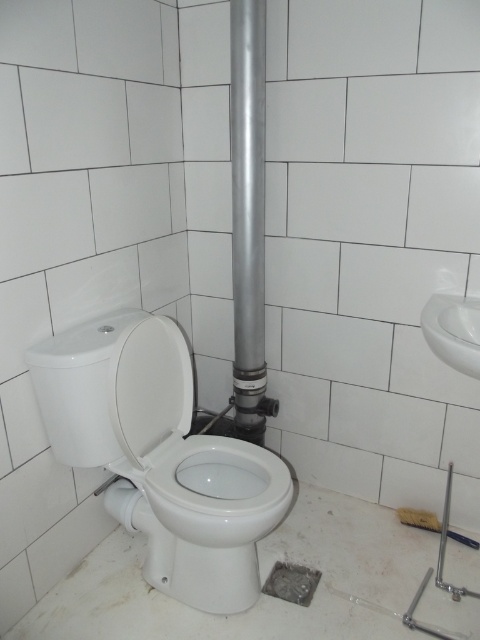
You are a bathroom cleaner and need to disinfect the white glossy toilet bowl at center and the white glossy toilet lid at center. You have a spray bottle with a range of 10 inches. Without moving the spray bottle, can you reach both objects from your current position?

The white glossy toilet bowl at center is 9.80 inches away from the white glossy toilet lid at center. Since the spray bottle has a range of 10 inches, you can reach both objects without moving the spray bottle because the distance between them is within the spray range.

You are a maintenance worker holding a 1.5 meter long tool. You need to inspect the silver metallic pipe at center. Can you reach it with your tool without moving anything?

The silver metallic pipe at center is 1.72 meters from camera. Since your tool is 1.5 meters long, it is shorter than the distance to the pipe. You cannot reach it without moving anything.

Based on the photo, you are a plumber trying to access the silver metallic pipe at center to fix a leak. However, the white glossy sink at right is blocking your path. Can you move the sink to reach the pipe?

The white glossy sink at right is behind the silver metallic pipe at center, so it is not blocking your path. You can access the silver metallic pipe at center directly without moving the sink.